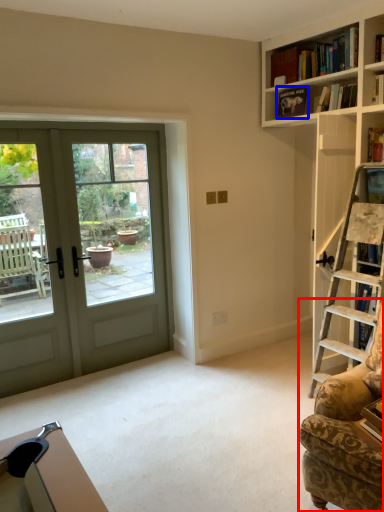
Question: Which of the following is the closest to the observer, rocking chair (highlighted by a red box) or book (highlighted by a blue box)?

Choices:
 (A) rocking chair
 (B) book

Answer: (A)